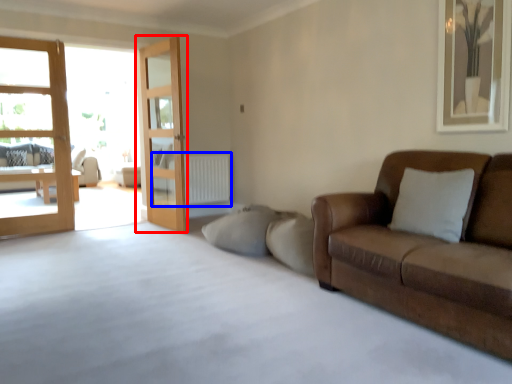
Question: Which point is closer to the camera, door (highlighted by a red box) or radiator (highlighted by a blue box)?

Choices:
 (A) door
 (B) radiator

Answer: (A)